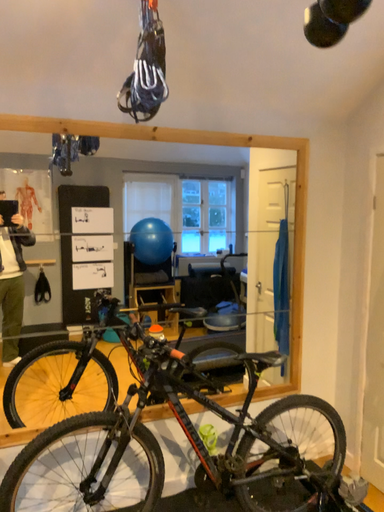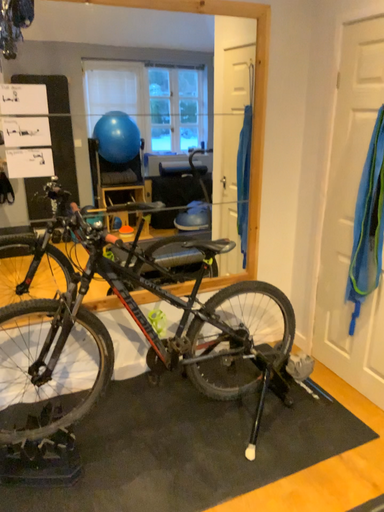
Question: Which way did the camera rotate in the video?

Choices:
 (A) rotated upward
 (B) rotated downward

Answer: (B)